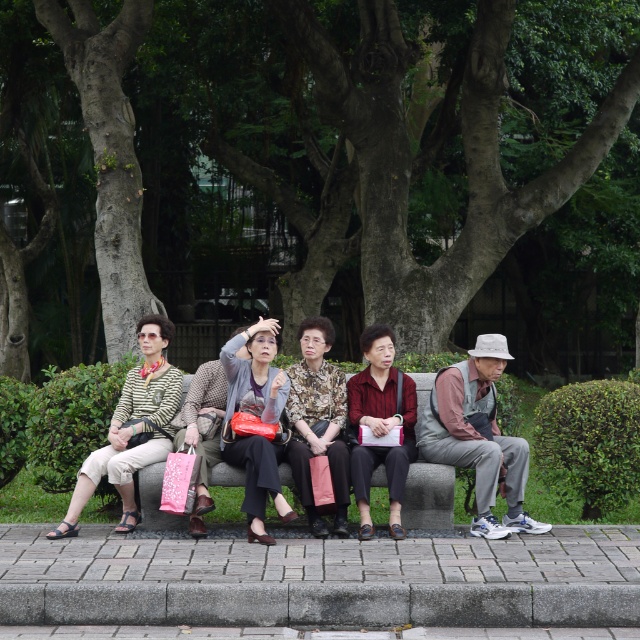
You are a painter who wants to paint the smooth gray bark at left and the gray stone bench at center. Which object should you focus on first if you want to paint the wider one?

The smooth gray bark at left is wider than the gray stone bench at center, so you should focus on painting the smooth gray bark at left first.

You are standing in the park and see the point at coordinates (125, 170). If you walk straight ahead, will you reach that point before walking 15 meters?

The point at coordinates (125, 170) is 12.98 meters away from the viewer, so yes, you will reach it before walking 15 meters.